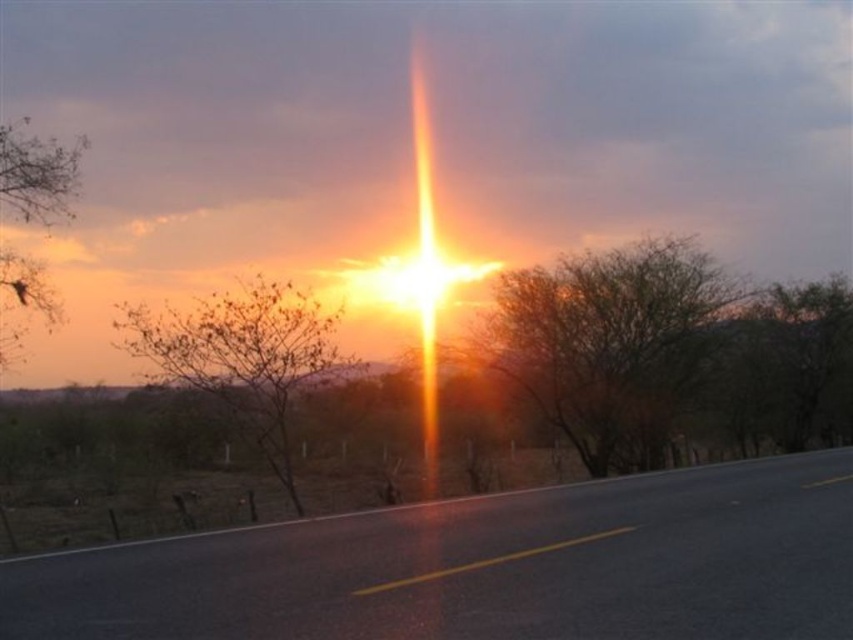
You are a photographer planning to capture the sunset scene. You want to ensure that both the black asphalt highway at center and the bare branches at left are clearly visible in your photo. Based on their spatial relationship, which object should you prioritize framing closer to the center of your composition?

The black asphalt highway at center occupies less space than the bare branches at left, so you should prioritize framing the bare branches at left closer to the center of your composition since they take up more visual real estate in the scene.

You are standing on the road in the sunset scene. You want to take a photo of the brown textured tree at center while ensuring the sun is not directly in the frame. Where should you position yourself relative to the tree?

The brown textured tree at center is located at point 0.534 on the horizontal axis and 0.709 on the vertical axis. To avoid the sun, which is at the center of the frame, you should position yourself either to the left or right of the tree, ensuring the tree is between you and the sun.